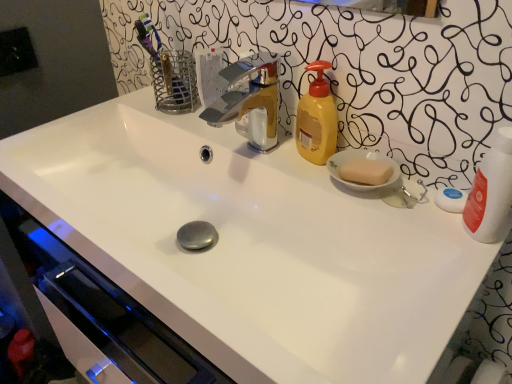
Question: Considering the positions of polished chrome faucet at center and white glossy bottle at right in the image, is polished chrome faucet at center taller or shorter than white glossy bottle at right?

Choices:
 (A) tall
 (B) short

Answer: (B)

Question: Which is correct: polished chrome faucet at center is inside white glossy bottle at right, or outside of it?

Choices:
 (A) outside
 (B) inside

Answer: (A)

Question: Which of these objects is positioned farthest from the white glossy bottle at right?

Choices:
 (A) polished chrome faucet at center
 (B) yellow matte soap dispenser at upper right

Answer: (A)

Question: Estimate the real-world distances between objects in this image. Which object is closer to the polished chrome faucet at center?

Choices:
 (A) yellow matte soap dispenser at upper right
 (B) white glossy bottle at right

Answer: (A)